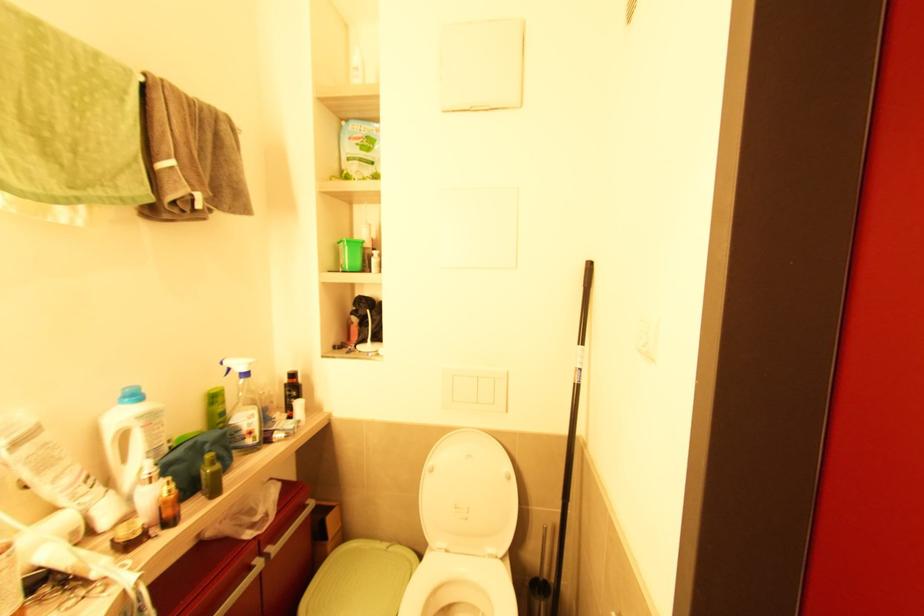
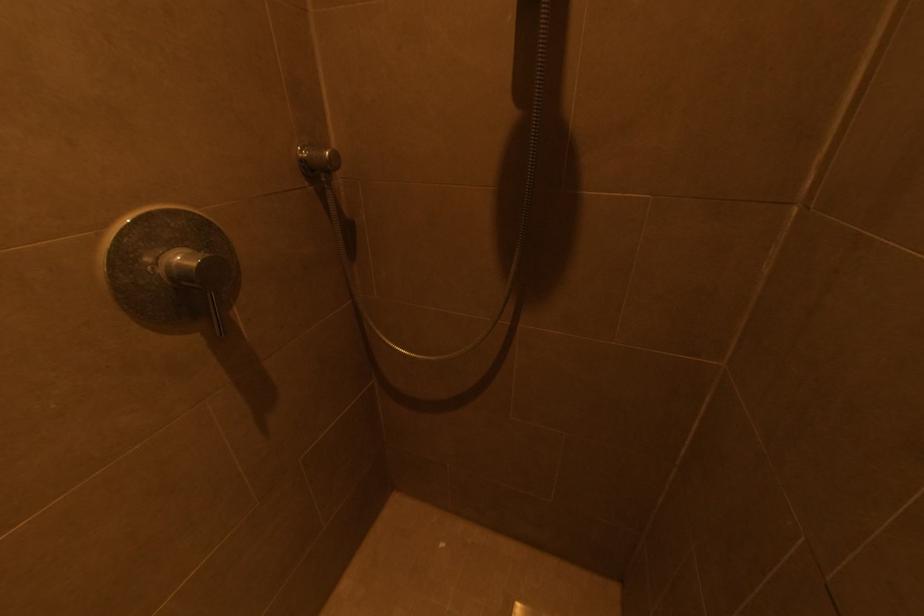
The images are taken continuously from a first-person perspective. In which direction is your viewpoint rotating?

The camera rotated toward left-down.